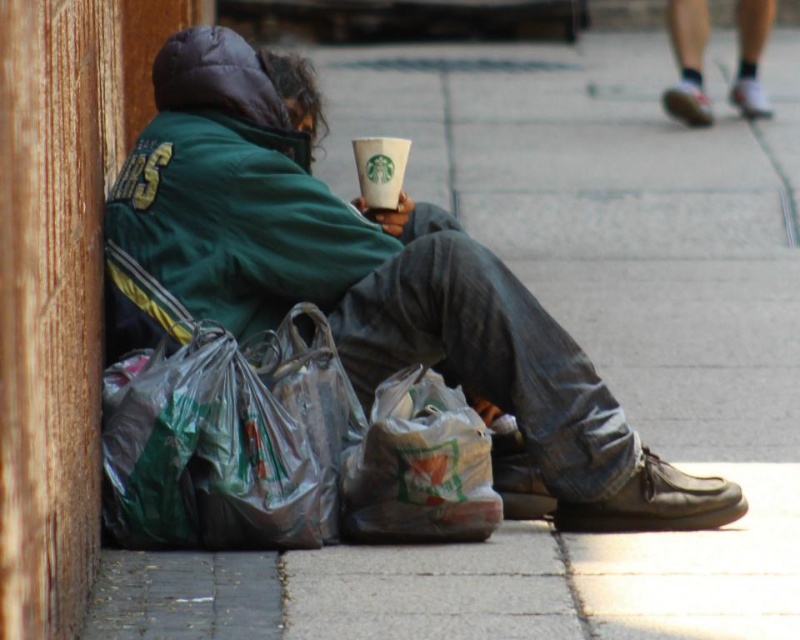
You are a delivery person who needs to place a small package between the green matte jacket at center and the white paper cup at center. Which object should you place the package closer to if the package is narrower than the space between them?

Since the green matte jacket at center is wider than the white paper cup at center, you should place the package closer to the white paper cup at center to ensure it fits within the available space.

You are a delivery person who needs to place a package between the green fabric jacket at center and the translucent plastic bag at lower center. Can you fit the package between them?

The green fabric jacket at center is to the left of the translucent plastic bag at lower center, so there is space between them to place the package.